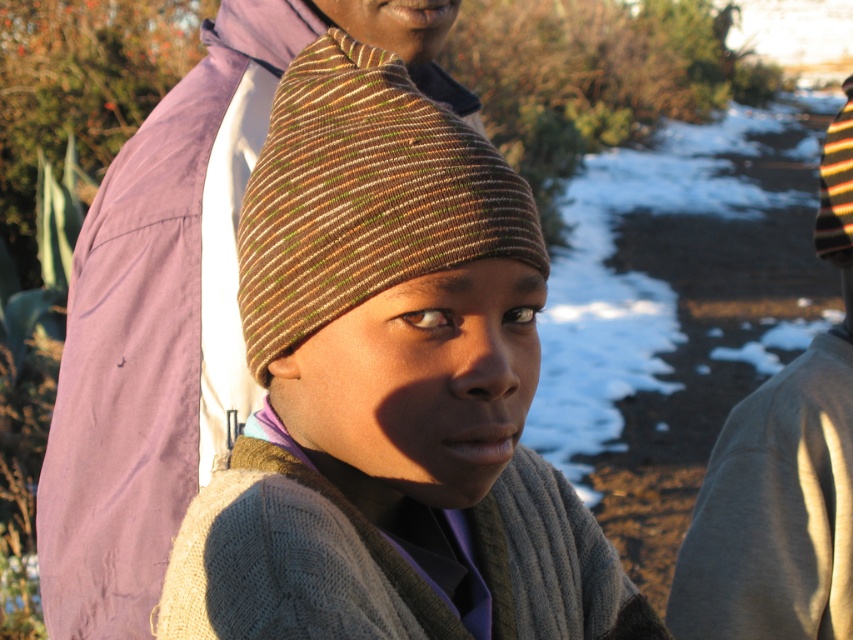
You are a photographer trying to capture a close shot of the knitted brown beanie at center and the white powdery snow at center. Your camera has a maximum focus range of 5 feet. Can you capture both subjects in focus without moving your position?

The knitted brown beanie at center and white powdery snow at center are 5.65 feet apart from each other. Since the distance exceeds the camera maximum focus range of 5 feet, you cannot capture both subjects in focus without moving your position.

You are a fashion designer analyzing the image. You need to determine the spatial relationship between the knitted brown beanie at center and the gray cotton sweater at right. Which object is positioned higher in the image?

The knitted brown beanie at center is located above the gray cotton sweater at right, so it is positioned higher in the image.